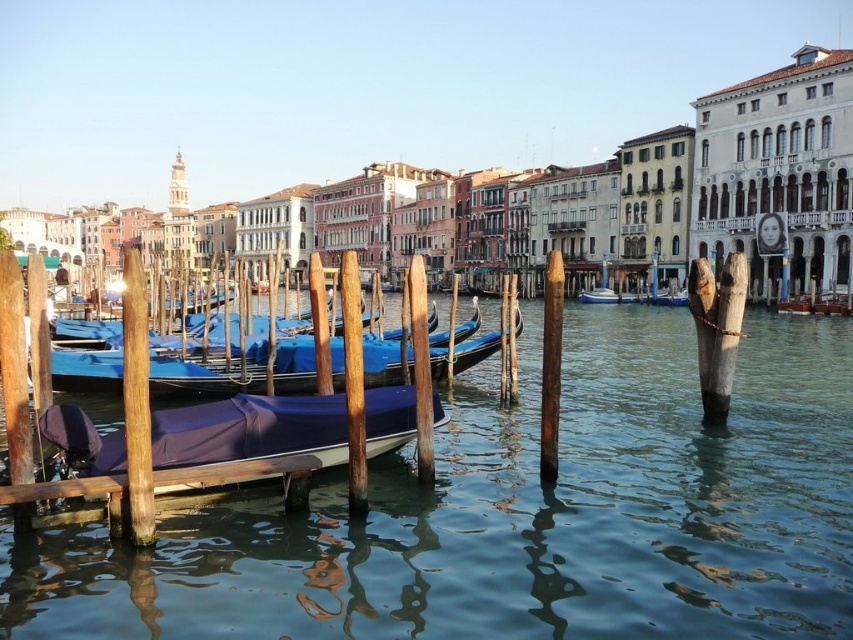
Question: Among these points, which one is farthest from the camera?

Choices:
 (A) (316, 620)
 (B) (86, 380)
 (C) (25, 488)
 (D) (637, 300)

Answer: (D)

Question: Does blue fabric boat at center appear on the right side of blue glossy boat at center?

Choices:
 (A) no
 (B) yes

Answer: (A)

Question: Is blue fabric-covered boat at center closer to the viewer compared to blue fabric boat at center?

Choices:
 (A) no
 (B) yes

Answer: (B)

Question: Among these points, which one is farthest from the camera?

Choices:
 (A) (587, 292)
 (B) (97, 492)
 (C) (374, 368)

Answer: (A)

Question: Which of the following is the farthest from the observer?

Choices:
 (A) (590, 296)
 (B) (218, 396)
 (C) (59, 483)
 (D) (717, 464)

Answer: (A)

Question: Can you confirm if brown wooden dock at lower left is smaller than blue glossy boat at center?

Choices:
 (A) yes
 (B) no

Answer: (B)